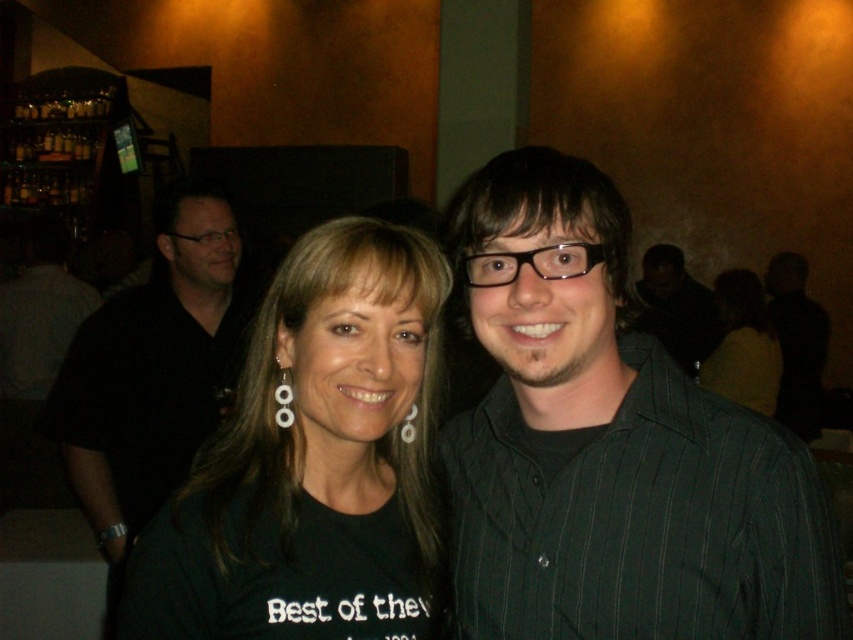
Is black matte shirt at left positioned behind black pinstriped shirt at right?

No, it is in front of black pinstriped shirt at right.

Can you confirm if black matte shirt at left is smaller than black pinstriped shirt at right?

Correct, black matte shirt at left occupies less space than black pinstriped shirt at right.

The width and height of the screenshot is (853, 640). Identify the location of black matte shirt at left. (152, 369).

Which is below, black pinstriped shirt at right or white pearl earring at upper center?

white pearl earring at upper center

Which is more to the right, black pinstriped shirt at right or white pearl earring at upper center?

From the viewer's perspective, black pinstriped shirt at right appears more on the right side.

Find the location of a particular element. The height and width of the screenshot is (640, 853). black pinstriped shirt at right is located at coordinates (798, 342).

Between matte black shirt at center and white pearl earring at center, which one appears on the right side from the viewer's perspective?

matte black shirt at center is more to the right.

Does point (751, 316) come behind point (283, 404)?

Yes, it is behind point (283, 404).

Where is `matte black shirt at center`? The width and height of the screenshot is (853, 640). matte black shirt at center is located at coordinates (743, 346).